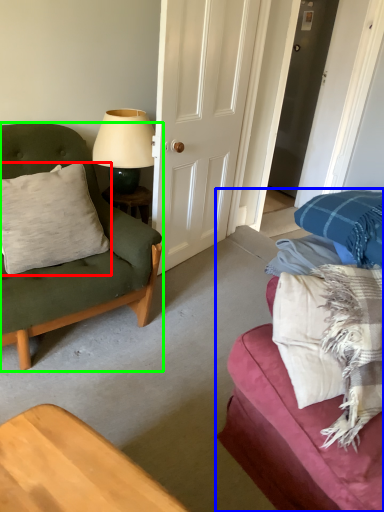
Question: Which object is positioned farthest from pillow (highlighted by a red box)? Select from studio couch (highlighted by a blue box) and chair (highlighted by a green box).

Choices:
 (A) studio couch
 (B) chair

Answer: (A)